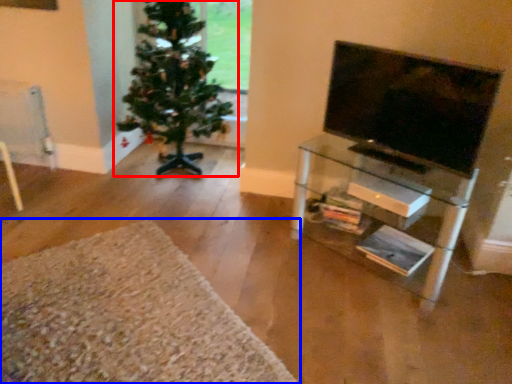
Question: Which object appears farthest to the camera in this image, christmas tree (highlighted by a red box) or plain (highlighted by a blue box)?

Choices:
 (A) christmas tree
 (B) plain

Answer: (A)